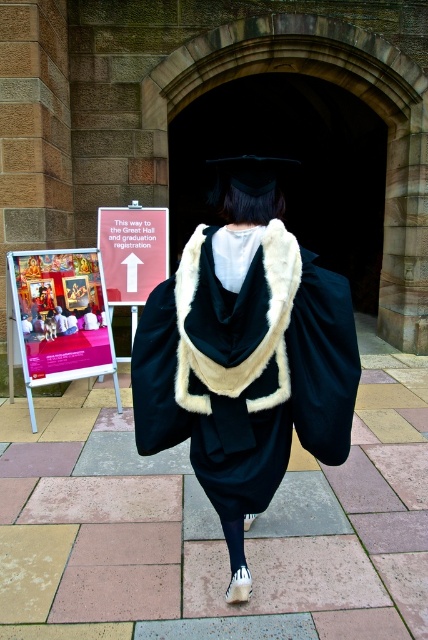
Question: Does matte pink fabric poster at left have a greater width compared to white paper sign at center?

Choices:
 (A) yes
 (B) no

Answer: (A)

Question: Does matte pink fabric poster at left have a smaller size compared to white paper sign at center?

Choices:
 (A) no
 (B) yes

Answer: (A)

Question: Which object appears closest to the camera in this image?

Choices:
 (A) matte black graduation gown at center
 (B) matte pink fabric poster at left

Answer: (A)

Question: Can you confirm if matte pink fabric poster at left is smaller than white paper sign at center?

Choices:
 (A) yes
 (B) no

Answer: (B)

Question: Among these points, which one is farthest from the camera?

Choices:
 (A) (124, 305)
 (B) (97, 355)

Answer: (A)

Question: Considering the real-world distances, which object is farthest from the white paper sign at center?

Choices:
 (A) matte pink fabric poster at left
 (B) matte black graduation gown at center

Answer: (B)